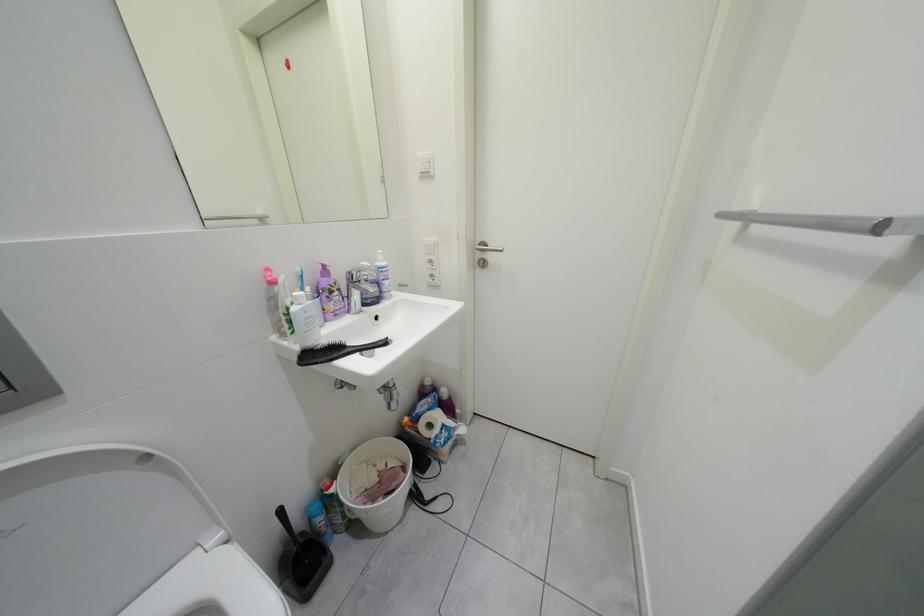
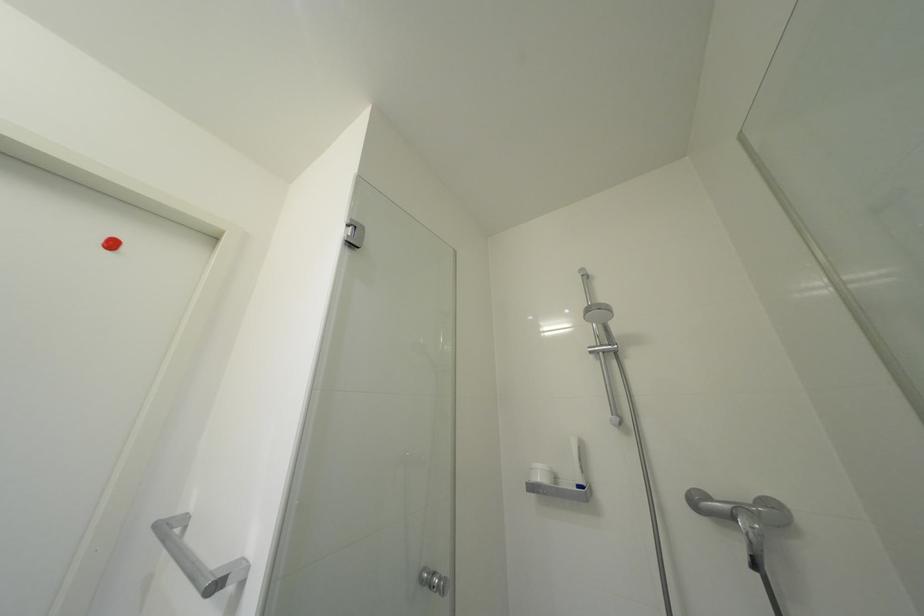
From the picture: Based on the continuous images, in which direction is the camera rotating?

The rotation direction of the camera is right-up.